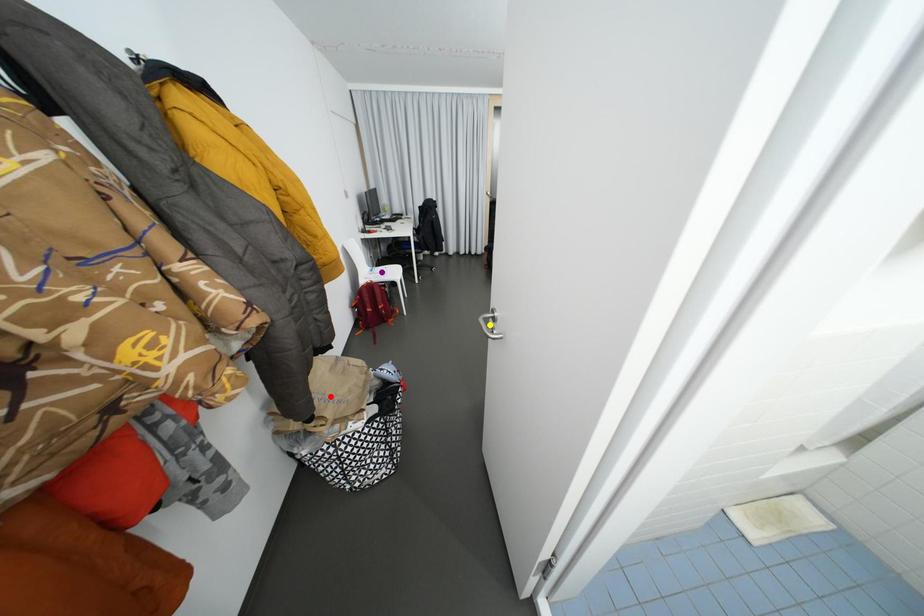
Order these from nearest to farthest:
yellow point, purple point, red point

yellow point → red point → purple point